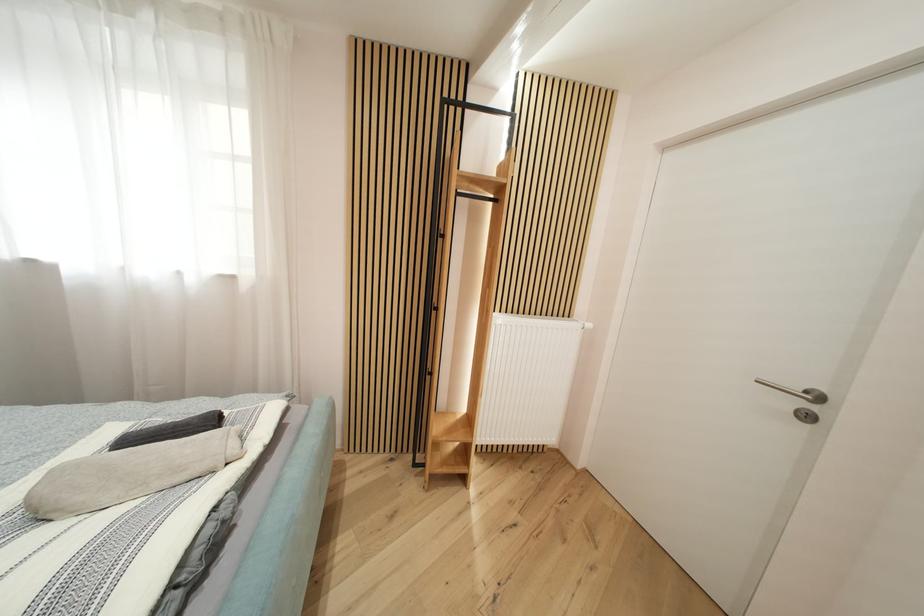
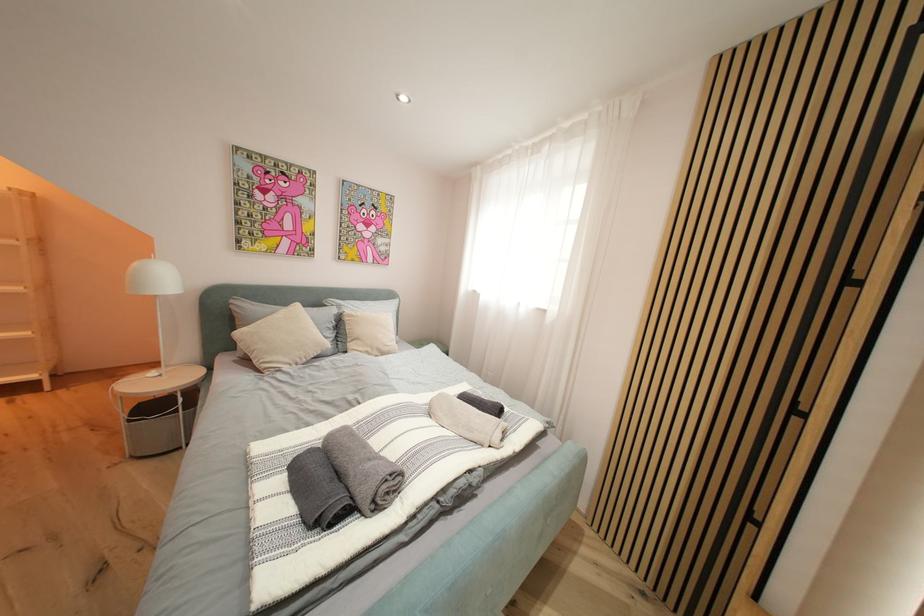
Question: The camera is either moving clockwise (left) or counter-clockwise (right) around the object. The first image is from the beginning of the video and the second image is from the end. Is the camera moving left or right when shooting the video?

Choices:
 (A) Left
 (B) Right

Answer: (B)